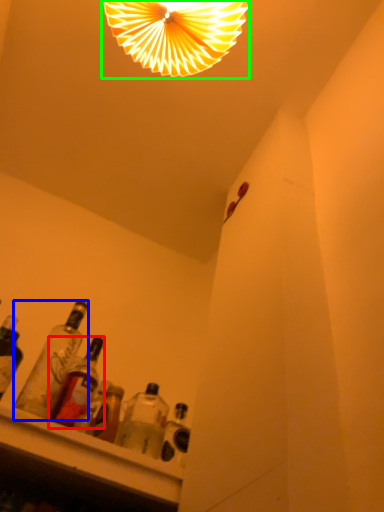
Question: Considering the real-world distances, which object is closest to bottle (highlighted by a red box)? bottle (highlighted by a blue box) or lamp (highlighted by a green box).

Choices:
 (A) bottle
 (B) lamp

Answer: (A)